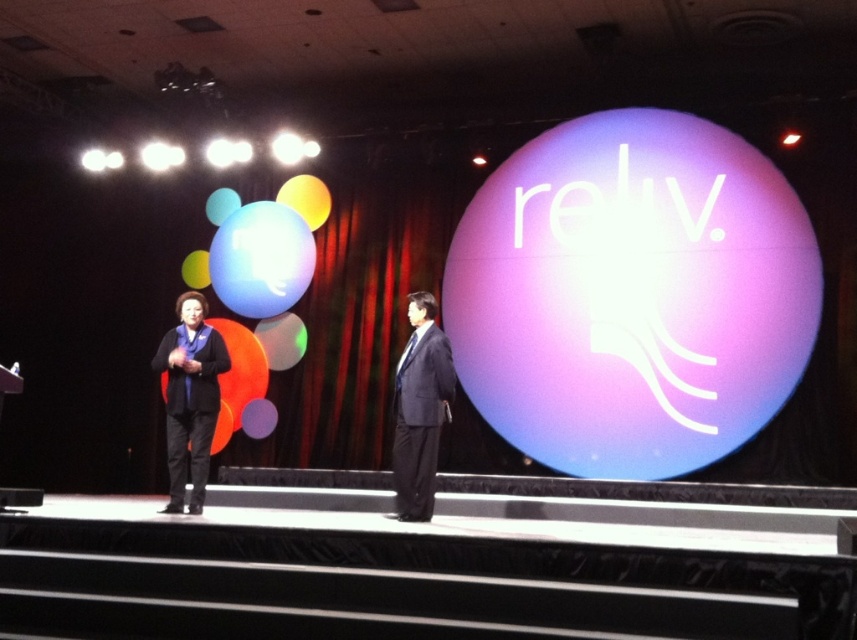
You are an event organizer who needs to place a microphone stand between the black matte business suit at left and the black matte business suit at center. Based on their positions, where should the microphone stand be placed?

The black matte business suit at left is positioned under the black matte business suit at center, so the microphone stand should be placed between them horizontally since they are vertically aligned.

In the scene shown: You are an event planner arranging a photoshoot on the stage. You need to position a camera so it can capture both the black matte business suit at left and the black matte business suit at center. Based on their positions, which side of the stage should you place the camera to ensure both are in frame?

The black matte business suit at left is to the left of the black matte business suit at center, so placing the camera centrally on the stage would allow both suits to be captured in the frame.